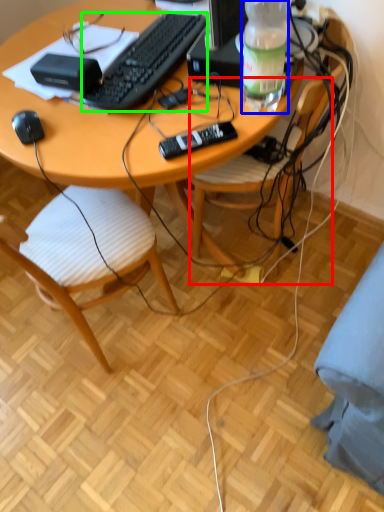
Question: Considering the real-world distances, which object is closest to chair (highlighted by a red box)? bottle (highlighted by a blue box) or computer keyboard (highlighted by a green box).

Choices:
 (A) bottle
 (B) computer keyboard

Answer: (A)